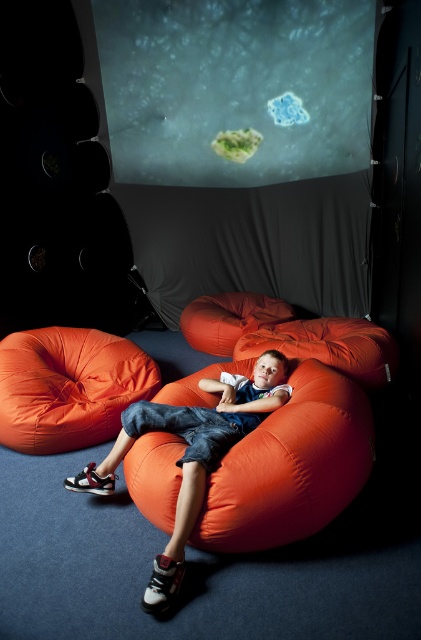
You are a visitor in this room and want to sit on the lower positioned orange fabric bean bag. Which one should you choose between the orange fabric bean bag at center and the orange fabric bean bag at lower left?

The orange fabric bean bag at center is the lower positioned one since it is below the orange fabric bean bag at lower left, so you should choose the orange fabric bean bag at center.

You are a delivery person who needs to place a new 1 meter long package between the orange fabric bean bag at lower left and the matte orange beanbag at center. Can you fit the package between them without moving either beanbag?

The distance between the orange fabric bean bag at lower left and the matte orange beanbag at center is 94.98 centimeters. Since the package is 1 meter long, which is longer than the space available, it won

You are a robot trying to locate the orange fabric bean bag at center in a room. The room has a coordinate system where the bottom left corner is the origin point. The robot can move in four directions. What direction should the robot move to reach the bean bag?

The orange fabric bean bag at center is located at coordinate point (290, 467). Since the coordinate system starts at the bottom left corner, the robot should move right and up to reach the bean bag.